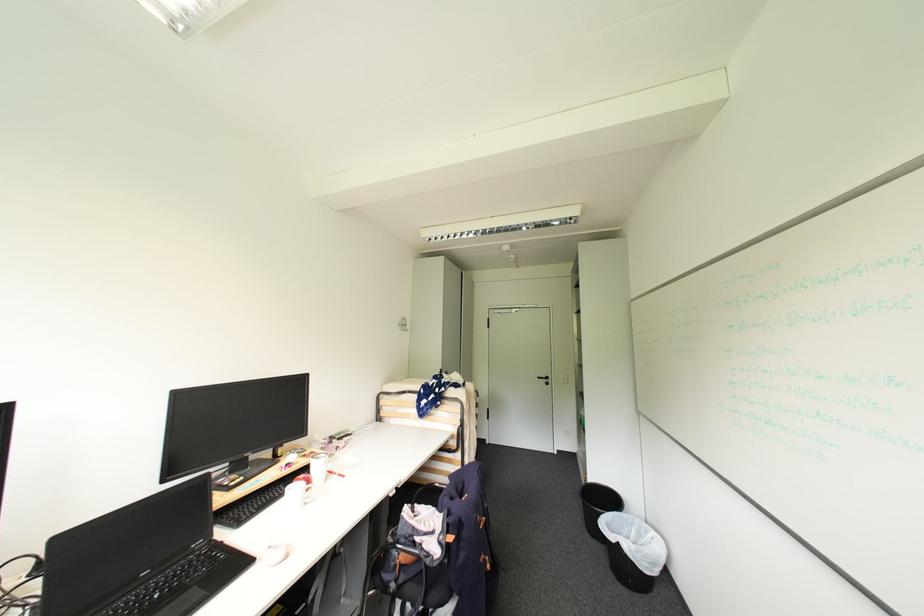
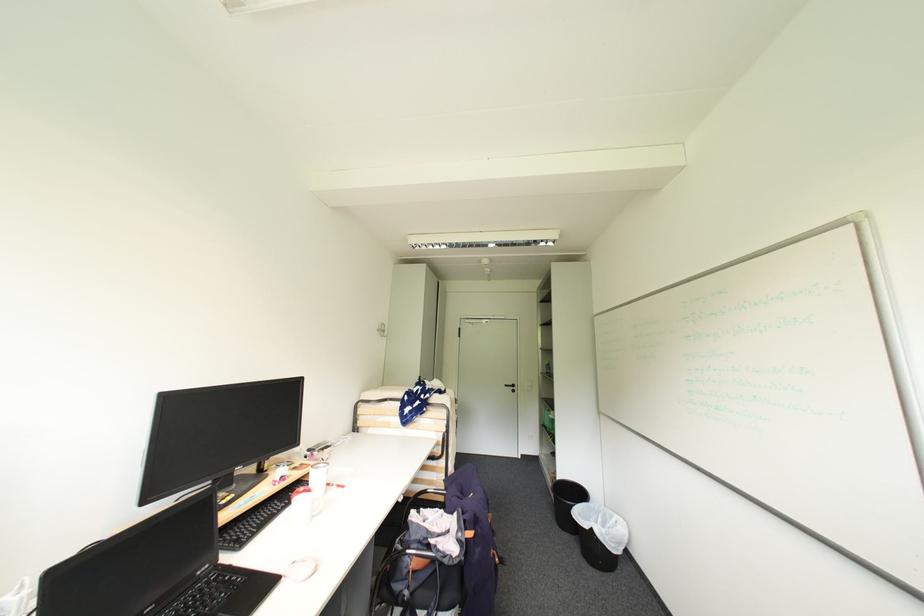
Question: The camera is either moving clockwise (left) or counter-clockwise (right) around the object. The first image is from the beginning of the video and the second image is from the end. Is the camera moving left or right when shooting the video?

Choices:
 (A) Left
 (B) Right

Answer: (A)